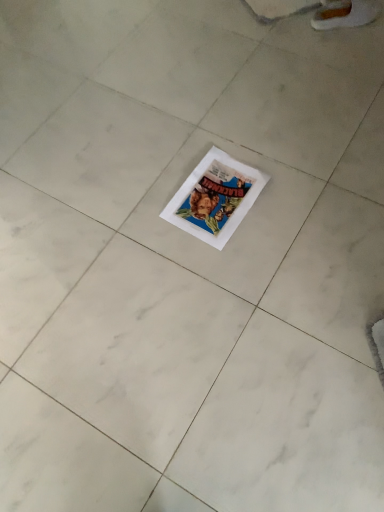
Image resolution: width=384 pixels, height=512 pixels. Find the location of `vacant region under white rubber shoe at upper right (from a real-world perspective)`. vacant region under white rubber shoe at upper right (from a real-world perspective) is located at coordinates (334, 19).